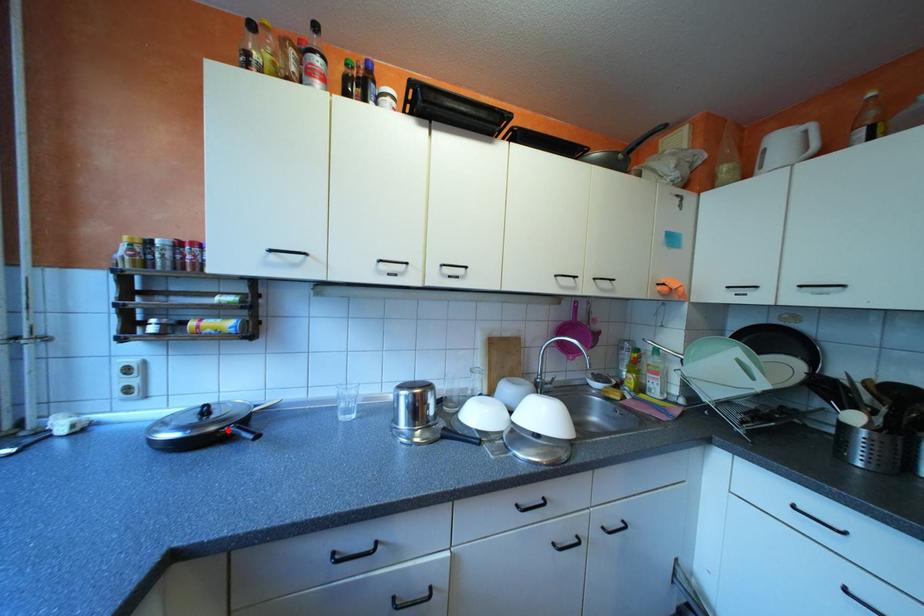
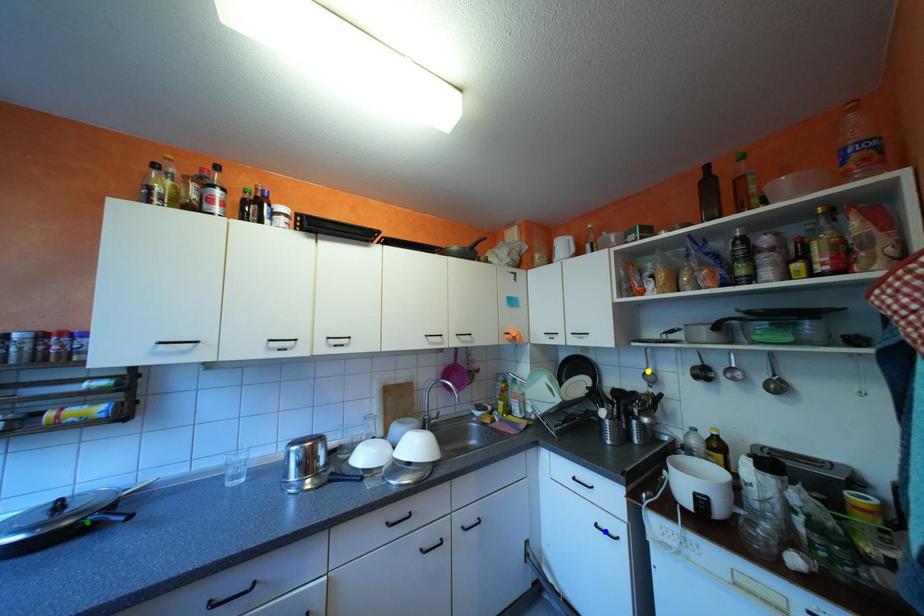
Question: I am providing you with two images of the same scene from different viewpoints. A red point is marked on the first image. You are given multiple points on the second image. In image 2, which mark is for the same physical point as the one in image 1?

Choices:
 (A) yellow point
 (B) green point
 (C) blue point

Answer: (B)